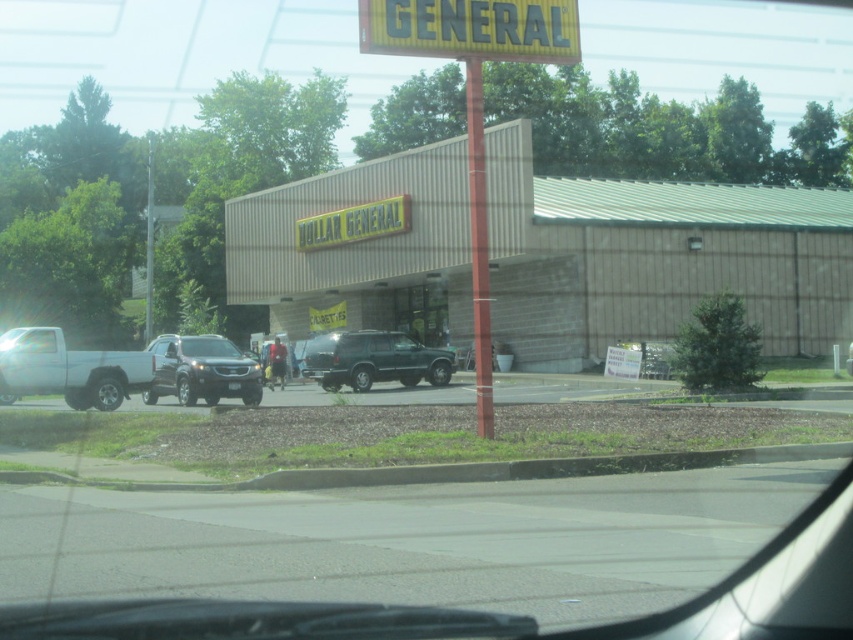
Question: Which point appears farthest from the camera in this image?

Choices:
 (A) (426, 374)
 (B) (386, 292)

Answer: (B)

Question: Is beige/textured building at center bigger than satin black suv at center?

Choices:
 (A) no
 (B) yes

Answer: (B)

Question: Is beige/textured building at center smaller than white matte truck at left?

Choices:
 (A) no
 (B) yes

Answer: (A)

Question: Which object is closer to the camera taking this photo?

Choices:
 (A) white matte truck at left
 (B) metallic green suv at center
 (C) beige/textured building at center

Answer: (A)

Question: Estimate the real-world distances between objects in this image. Which object is farther from the beige/textured building at center?

Choices:
 (A) satin black suv at center
 (B) white matte truck at left
 (C) metallic green suv at center

Answer: (B)

Question: Is beige/textured building at center positioned at the back of satin black suv at center?

Choices:
 (A) yes
 (B) no

Answer: (A)